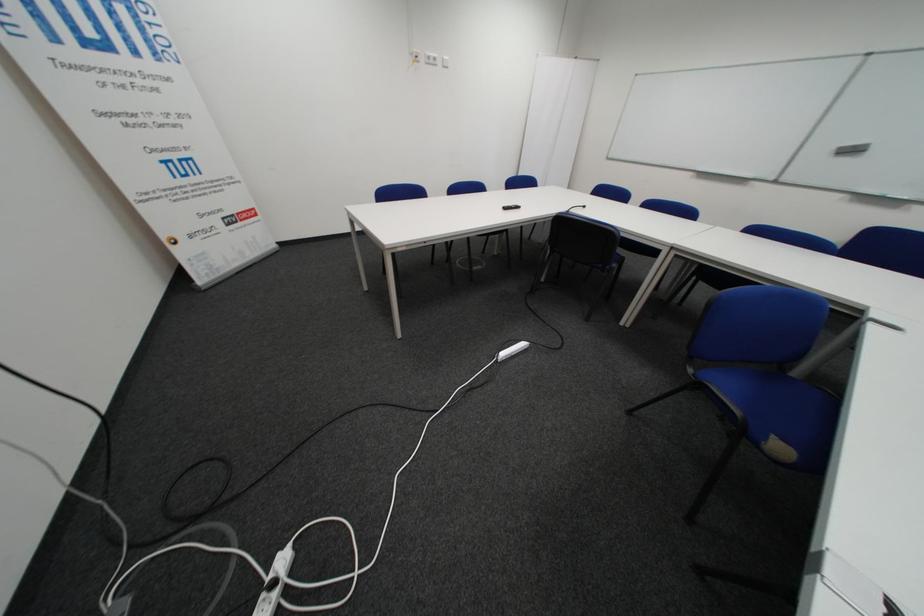
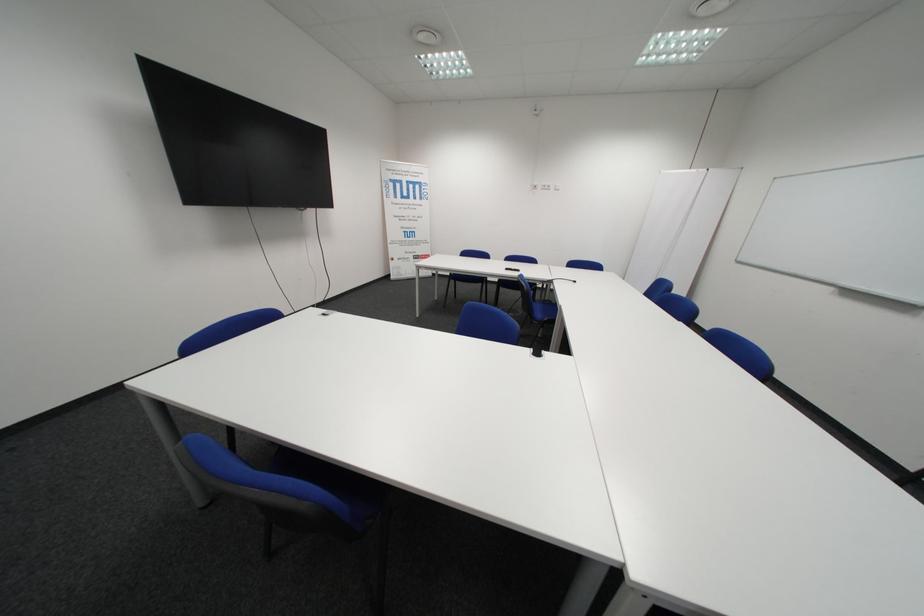
Where in the second image is the point corresponding to the point at 440,62 from the first image?

(554, 188)